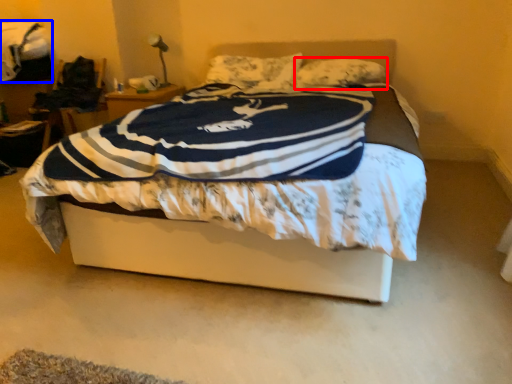
Question: Among these objects, which one is farthest to the camera, pillow (highlighted by a red box) or blanket (highlighted by a blue box)?

Choices:
 (A) pillow
 (B) blanket

Answer: (B)